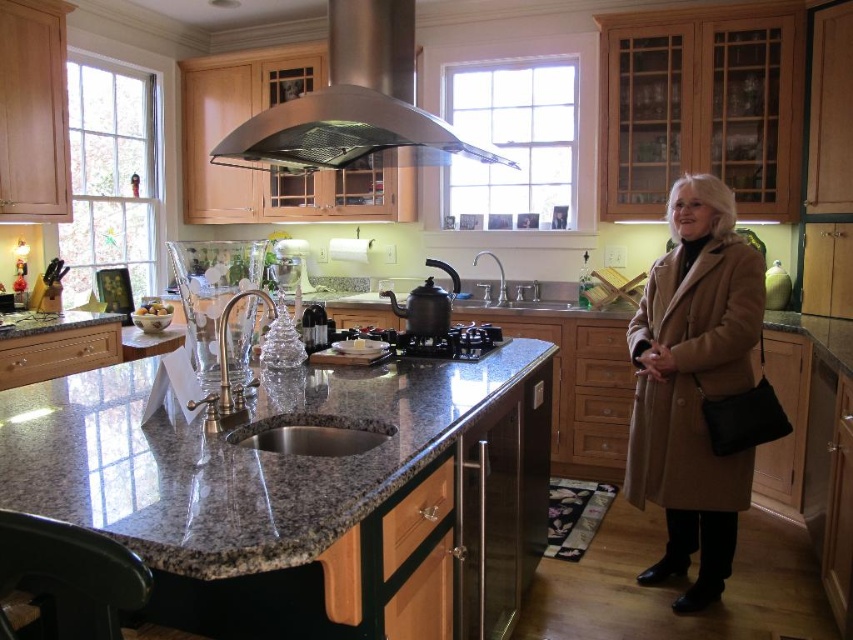
Who is more forward, [322,378] or [514,300]?

Point [322,378]

Is point (407, 476) closer to camera compared to point (486, 296)?

Yes, it is.

Find the location of a particular element. This screenshot has width=853, height=640. granite at center is located at coordinates (239, 456).

Is point (723, 332) farther from camera compared to point (415, 355)?

No, (723, 332) is closer to viewer.

Is beige wool coat at right taller than black glass stove at center?

Yes, beige wool coat at right is taller than black glass stove at center.

Which is behind, point (695, 540) or point (410, 336)?

Positioned behind is point (695, 540).

The width and height of the screenshot is (853, 640). Find the location of `beige wool coat at right`. beige wool coat at right is located at coordinates (x=694, y=385).

Find the location of a particular element. This screenshot has height=640, width=853. granite at center is located at coordinates (239, 456).

Can you confirm if granite at center is taller than beige wool coat at right?

In fact, granite at center may be shorter than beige wool coat at right.

Between point (141, 461) and point (683, 540), which one is positioned behind?

The point (683, 540) is more distant.

At what (x,y) coordinates should I click in order to perform the action: click on granite at center. Please return your answer as a coordinate pair (x, y). Looking at the image, I should click on (239, 456).